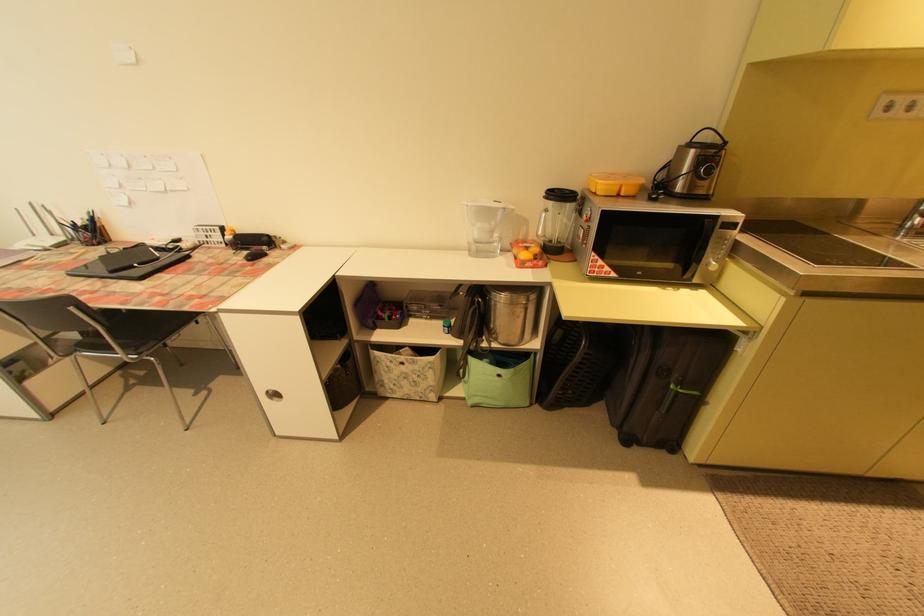
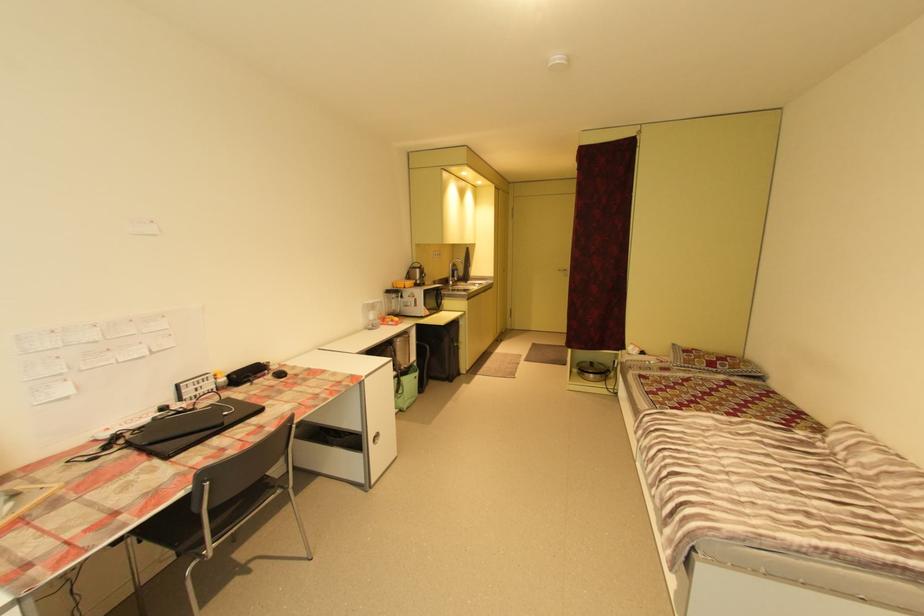
Find the pixel in the second image that matches point (142, 265) in the first image.

(232, 414)